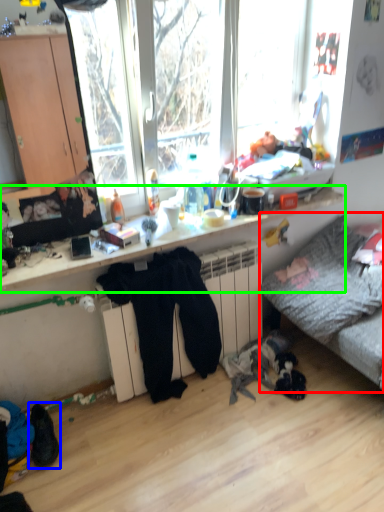
Question: Considering the real-world distances, which object is closest to studio couch (highlighted by a red box)? footwear (highlighted by a blue box) or desk (highlighted by a green box).

Choices:
 (A) footwear
 (B) desk

Answer: (B)